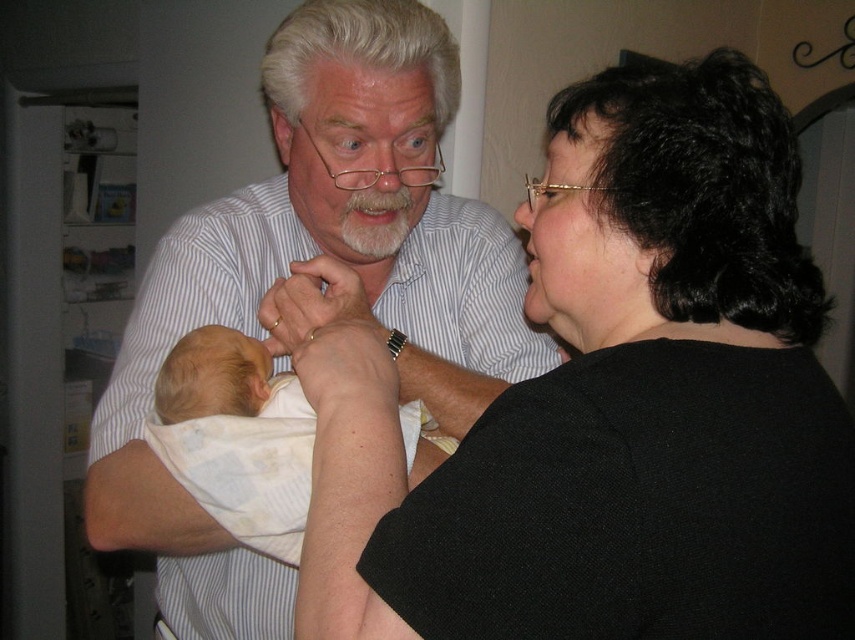
You are a photographer adjusting your camera settings to focus on two specific points in the image. The first point is at coordinate point (228, 516) and the second is at point (342, 88). Which point should you focus on first if you want to ensure the closest object is in sharp focus?

Point (228, 516) is closer to the camera than point (342, 88), so you should focus on point (228, 516) first to ensure the closest object is in sharp focus.

Based on the scene description, which object is located lower between the white striped shirt at upper left and the white hair at upper center?

The white striped shirt at upper left is positioned under the white hair at upper center, so it is located lower.

You are standing in the room and want to place a small decoration between the two points, point (544,436) and point (282,81). Which point should the decoration be closer to if you want it to appear larger in the image?

The decoration should be placed closer to point (544,436) because it is closer to the viewer, making objects placed there appear larger in the image compared to point (282,81) which is farther away.